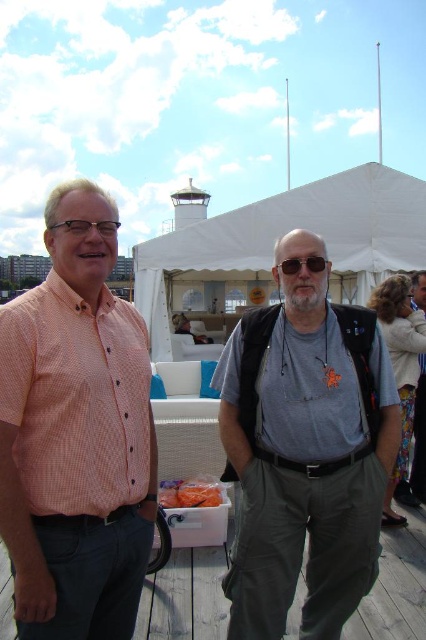
Does point (43, 472) come behind point (402, 294)?

No, it is in front of (402, 294).

Which of these two, orange checkered shirt at left or blonde hair woman at right, stands shorter?

blonde hair woman at right is shorter.

The image size is (426, 640). What are the coordinates of `orange checkered shirt at left` in the screenshot? It's located at (75, 433).

Identify the location of orange checkered shirt at left. (75, 433).

Between blonde hair woman at right and sunglasses at center, which one has less height?

Standing shorter between the two is sunglasses at center.

Between point (382, 289) and point (293, 269), which one is positioned behind?

Point (382, 289)

The height and width of the screenshot is (640, 426). What are the coordinates of `blonde hair woman at right` in the screenshot? It's located at (400, 368).

Is orange checkered shirt at left positioned at the back of gray matte t-shirt at center?

No, orange checkered shirt at left is in front of gray matte t-shirt at center.

Which is below, orange checkered shirt at left or gray matte t-shirt at center?

gray matte t-shirt at center is below.

Identify the location of orange checkered shirt at left. This screenshot has width=426, height=640. (75, 433).